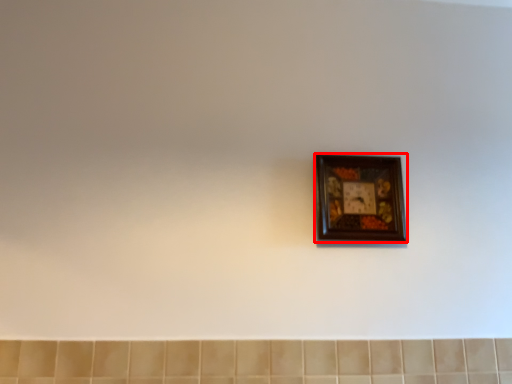
Question: Where is picture frame (annotated by the red box) located in relation to ceramic tile in the image?

Choices:
 (A) right
 (B) left

Answer: (A)